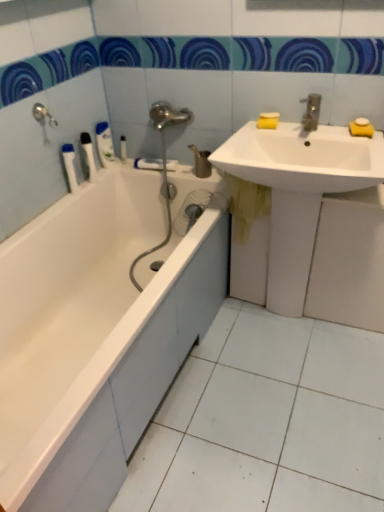
At what (x,y) coordinates should I click in order to perform the action: click on vacant area located to the right-hand side of yellow matte soap at upper right, the 1th soap when ordered from left to right. Please return your answer as a coordinate pair (x, y). The image size is (384, 512). Looking at the image, I should click on (309, 128).